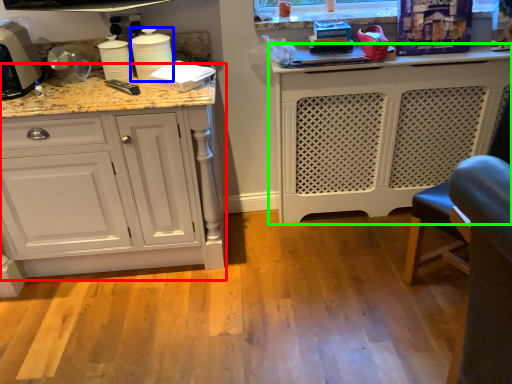
Question: Based on their relative distances, which object is farther from cabinetry (highlighted by a red box)? Choose from appliance (highlighted by a blue box) and cabinetry (highlighted by a green box).

Choices:
 (A) appliance
 (B) cabinetry

Answer: (B)